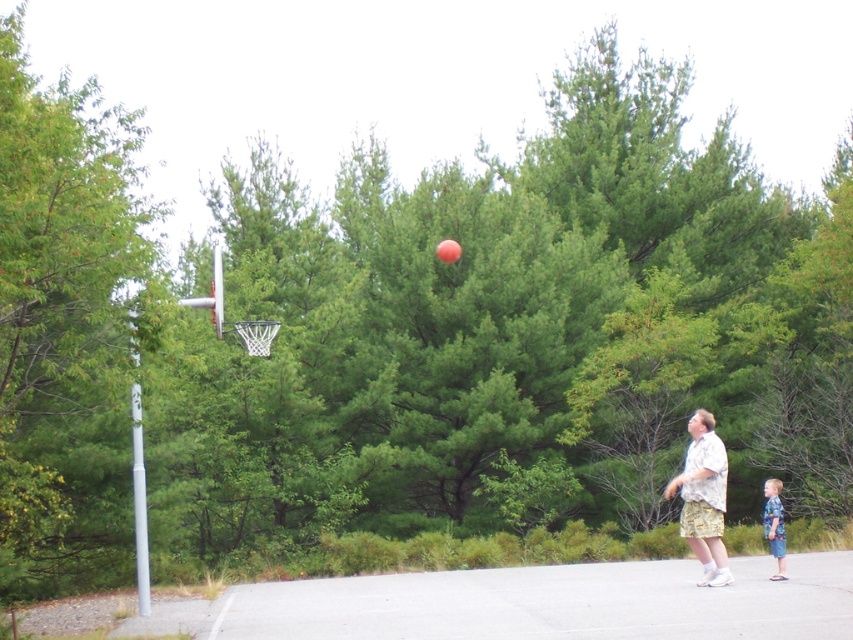
Does light brown textured shorts at lower right have a greater height compared to blue plaid shirt at lower right?

Yes, light brown textured shorts at lower right is taller than blue plaid shirt at lower right.

Is point (695, 458) farther from camera compared to point (778, 492)?

No, it is not.

Who is more distant from viewer, (x=688, y=451) or (x=775, y=552)?

The point (x=688, y=451) is behind.

Locate an element on the screen. light brown textured shorts at lower right is located at coordinates (703, 499).